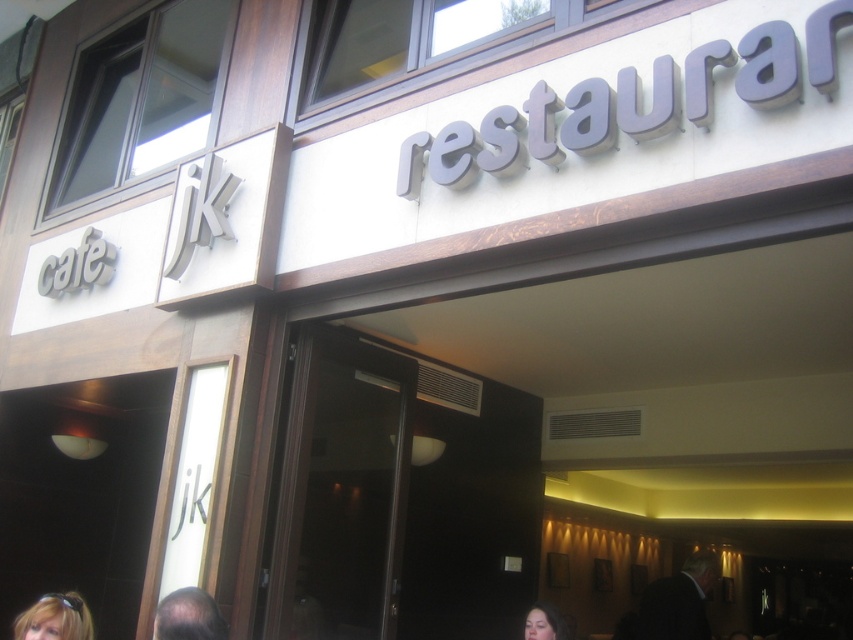
Between blonde hair at lower left and smooth skin face at lower center, which one appears on the right side from the viewer's perspective?

smooth skin face at lower center

Does blonde hair at lower left appear under smooth skin face at lower center?

Yes, blonde hair at lower left is below smooth skin face at lower center.

In order to click on blonde hair at lower left in this screenshot , I will do `click(55, 618)`.